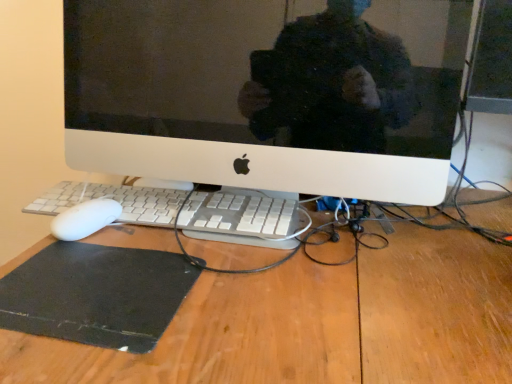
Identify the location of vacant space in between white plastic computer monitor at center and black rubber mousepad at lower left. Image resolution: width=512 pixels, height=384 pixels. (273, 282).